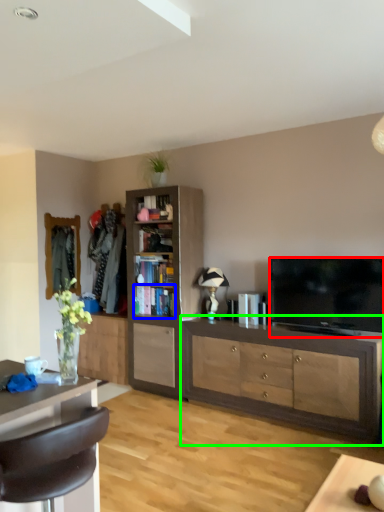
Question: Which object is the closest to the television (highlighted by a red box)? Choose among these: shelf (highlighted by a blue box) or cabinetry (highlighted by a green box).

Choices:
 (A) shelf
 (B) cabinetry

Answer: (B)